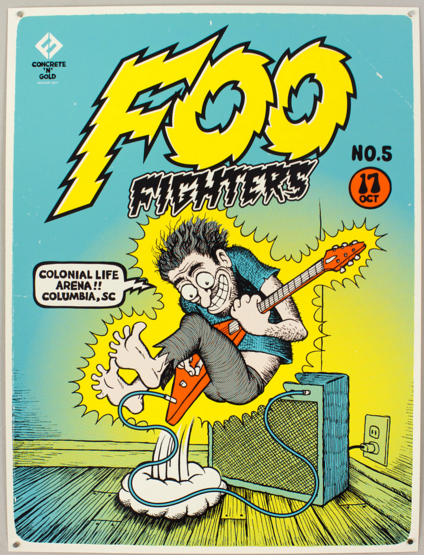
Image resolution: width=424 pixels, height=555 pixels. I want to click on wall, so click(390, 386).